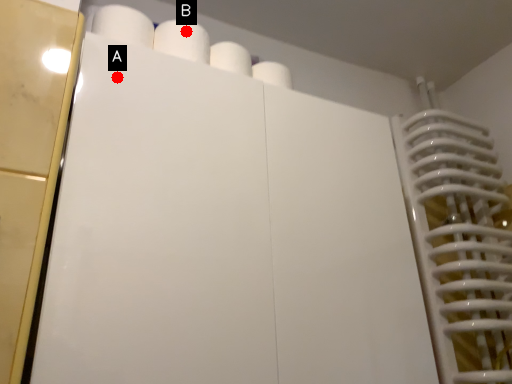
Question: Two points are circled on the image, labeled by A and B beside each circle. Which point is closer to the camera?

Choices:
 (A) A is closer
 (B) B is closer

Answer: (A)